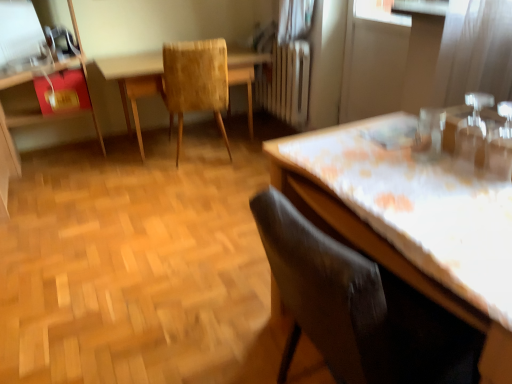
The width and height of the screenshot is (512, 384). What are the coordinates of `vacant area in front of textured beige chair at center, which is the 1th chair in left-to-right order` in the screenshot? It's located at point(192,180).